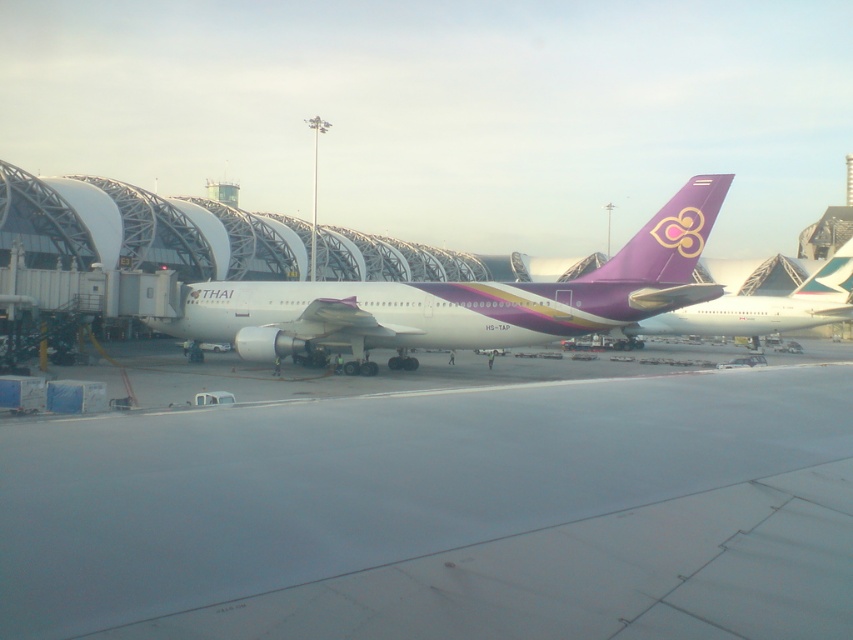
You are a pilot preparing for takeoff and need to check the runway ahead of your aircraft. Based on the scene, is the smooth concrete runway at center visible and accessible from the white glossy airplane at center?

The smooth concrete runway at center is in front of the white glossy airplane at center, so it is visible and accessible for takeoff.

You are a passenger sitting in the airplane and looking out the window. You see the white glossy airplane at center and the purple glossy airplane at upper right. Which airplane is parked closer to your current position?

The white glossy airplane at center is closer to the viewer than the purple glossy airplane at upper right, so the white glossy airplane at center is parked closer to your current position.